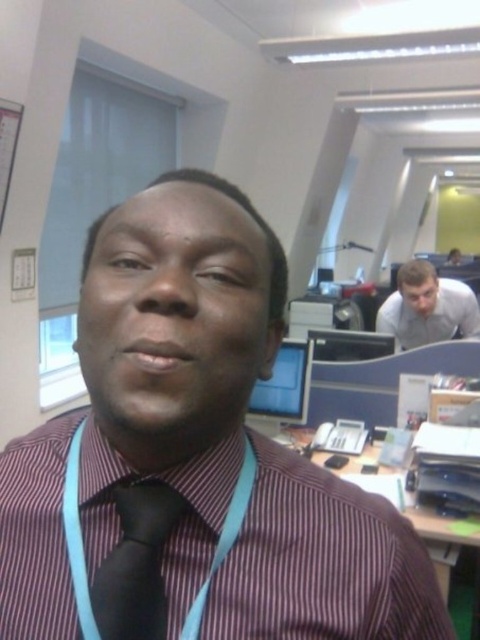
You are standing in the office and need to determine which of the two points, point [222,484] or point [305,364], is nearer to you. Based on the scene, which point is closer?

Point [222,484] is closer to the viewer than point [305,364].

Looking at this image, you are organizing a clothing store and need to arrange the striped cotton shirt at center and the white glossy shirt at upper right on a rack. Which shirt should be placed lower on the rack to ensure both are visible?

The striped cotton shirt at center should be placed lower on the rack because it is shorter than the white glossy shirt at upper right, allowing both shirts to be visible without one blocking the other.

You are an office worker who needs to choose between two shirts for a presentation. The striped cotton shirt at center and the white glossy shirt at upper right are available. Which shirt is narrower in width?

The striped cotton shirt at center has a lesser width compared to the white glossy shirt at upper right, so the striped cotton shirt at center is narrower in width.